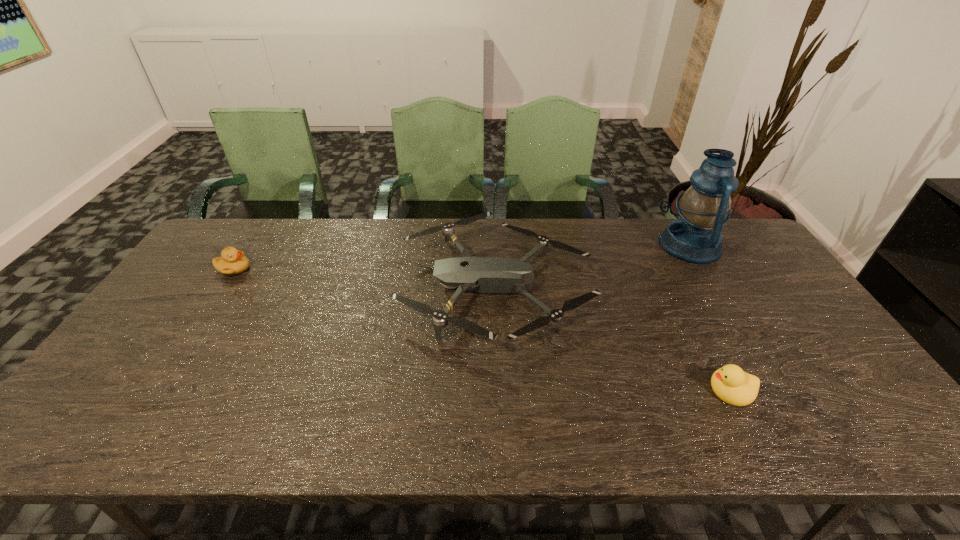
This screenshot has height=540, width=960. Identify the location of lantern. (695, 237).

This screenshot has width=960, height=540. I want to click on the second object from left to right, so click(482, 275).

The image size is (960, 540). What are the coordinates of `the farther duckling` in the screenshot? It's located at (232, 261).

Find the location of a particular element. Image resolution: width=960 pixels, height=540 pixels. the leftmost object is located at coordinates (232, 261).

The height and width of the screenshot is (540, 960). Find the location of `the nearer duckling`. the nearer duckling is located at coordinates (730, 383).

This screenshot has width=960, height=540. Identify the location of the right duckling. (730, 383).

You are a GUI agent. You are given a task and a screenshot of the screen. Output one action in this format:
    pyautogui.click(x=<x>, y=<y>)
    Task: Click on the free space located 0.400m on the face of the lantern
    This screenshot has height=540, width=960.
    Given the screenshot: What is the action you would take?
    pyautogui.click(x=541, y=245)

Find the location of a particular element. This screenshot has width=960, height=540. free spot located 0.120m on the face of the lantern is located at coordinates (624, 245).

Identify the location of blank area located 0.360m on the face of the lantern. Image resolution: width=960 pixels, height=540 pixels. 553,245.

Image resolution: width=960 pixels, height=540 pixels. What are the coordinates of `vacant point located 0.190m with a camera mounted on the front of the second object from left to right` in the screenshot? It's located at coord(336,286).